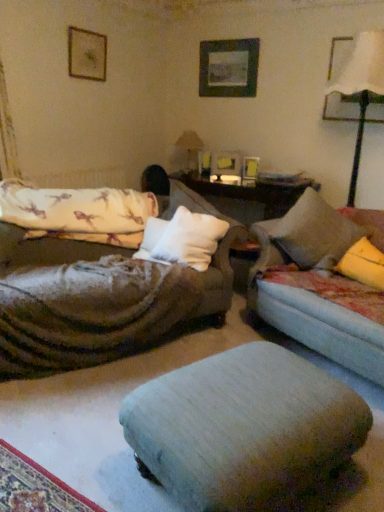
Question: From the image's perspective, does matte beige table lamp at center, which is the second table lamp from right to left, appear lower than light gray fabric footrest at center?

Choices:
 (A) no
 (B) yes

Answer: (A)

Question: Could you tell me if matte beige table lamp at center, which is the 1th table lamp from back to front, is facing light gray fabric footrest at center?

Choices:
 (A) yes
 (B) no

Answer: (B)

Question: Considering the relative sizes of matte beige table lamp at center, which is the first table lamp in left-to-right order, and light gray fabric footrest at center in the image provided, is matte beige table lamp at center, which is the first table lamp in left-to-right order, thinner than light gray fabric footrest at center?

Choices:
 (A) no
 (B) yes

Answer: (B)

Question: Can you confirm if matte beige table lamp at center, which is the second table lamp from right to left, is taller than light gray fabric footrest at center?

Choices:
 (A) yes
 (B) no

Answer: (A)

Question: Does matte beige table lamp at center, which is the 1th table lamp from back to front, contain light gray fabric footrest at center?

Choices:
 (A) no
 (B) yes

Answer: (A)

Question: In the image, is yellow fabric pillow at right, acting as the 1th pillow starting from the right, on the left side or the right side of matte black picture frame at upper right, which is the 4th picture frame in left-to-right order?

Choices:
 (A) left
 (B) right

Answer: (A)

Question: Based on their sizes in the image, would you say yellow fabric pillow at right, acting as the 1th pillow starting from the right, is bigger or smaller than matte black picture frame at upper right, which appears as the 1th picture frame when viewed from the right?

Choices:
 (A) big
 (B) small

Answer: (A)

Question: From the image's perspective, is yellow fabric pillow at right, acting as the 1th pillow starting from the right, above or below matte black picture frame at upper right, which is the 4th picture frame in left-to-right order?

Choices:
 (A) below
 (B) above

Answer: (A)

Question: Do you think yellow fabric pillow at right, acting as the 1th pillow starting from the right, is within matte black picture frame at upper right, which is the 4th picture frame in left-to-right order, or outside of it?

Choices:
 (A) inside
 (B) outside

Answer: (B)

Question: In terms of height, does white fabric lampshade at upper right, arranged as the 2th table lamp when viewed from the left, look taller or shorter compared to matte black picture frame at upper right, which appears as the 1th picture frame when viewed from the right?

Choices:
 (A) short
 (B) tall

Answer: (B)

Question: Considering the relative positions of white fabric lampshade at upper right, which appears as the second table lamp when viewed from the back, and matte black picture frame at upper right, which is the 4th picture frame in left-to-right order, in the image provided, is white fabric lampshade at upper right, which appears as the second table lamp when viewed from the back, to the left or to the right of matte black picture frame at upper right, which is the 4th picture frame in left-to-right order,?

Choices:
 (A) left
 (B) right

Answer: (A)

Question: Is point (359, 133) closer or farther from the camera than point (374, 64)?

Choices:
 (A) farther
 (B) closer

Answer: (A)

Question: Is white fabric lampshade at upper right, which appears as the second table lamp when viewed from the back, inside or outside of matte black picture frame at upper right, which appears as the 1th picture frame when viewed from the right?

Choices:
 (A) outside
 (B) inside

Answer: (A)

Question: Considering their positions, is light gray fabric footrest at center located in front of or behind white fabric lampshade at upper right, arranged as the 2th table lamp when viewed from the left?

Choices:
 (A) front
 (B) behind

Answer: (A)

Question: Would you say light gray fabric footrest at center is to the left or to the right of white fabric lampshade at upper right, which appears as the second table lamp when viewed from the back, in the picture?

Choices:
 (A) left
 (B) right

Answer: (A)